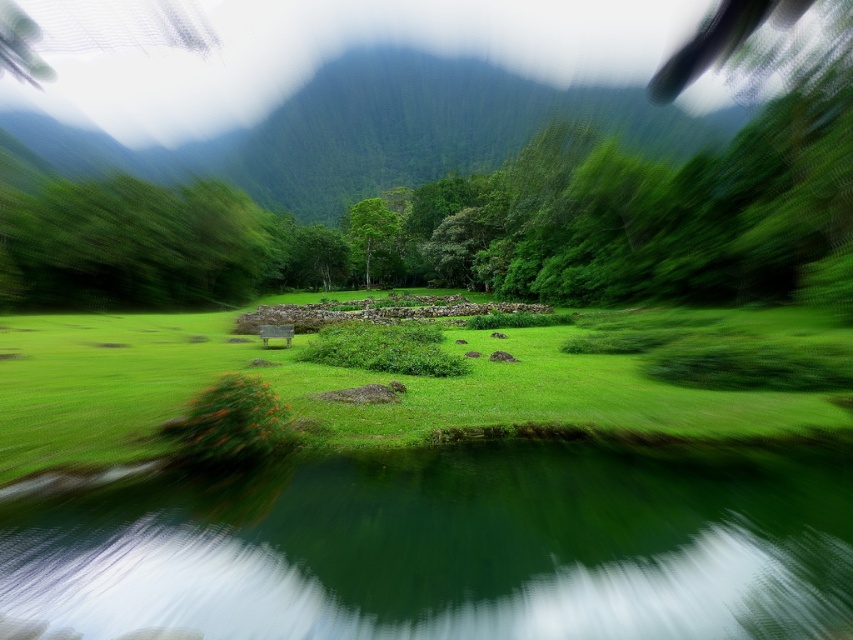
Question: Can you confirm if green leafy mountain at upper center is thinner than green matte tree at center?

Choices:
 (A) no
 (B) yes

Answer: (A)

Question: Which of the following is the closest to the observer?

Choices:
 (A) (639, 88)
 (B) (73, 401)
 (C) (363, 198)
 (D) (392, 481)

Answer: (D)

Question: Is green grassy at center thinner than green leafy mountain at upper center?

Choices:
 (A) yes
 (B) no

Answer: (A)

Question: Which of the following is the closest to the observer?

Choices:
 (A) (360, 212)
 (B) (131, 394)

Answer: (B)

Question: Is green leafy mountain at upper center smaller than green matte tree at center?

Choices:
 (A) no
 (B) yes

Answer: (A)

Question: Which object is farther from the camera taking this photo?

Choices:
 (A) green leafy mountain at upper center
 (B) green grassy at center
 (C) green smooth water at lower center
 (D) green matte tree at center

Answer: (D)